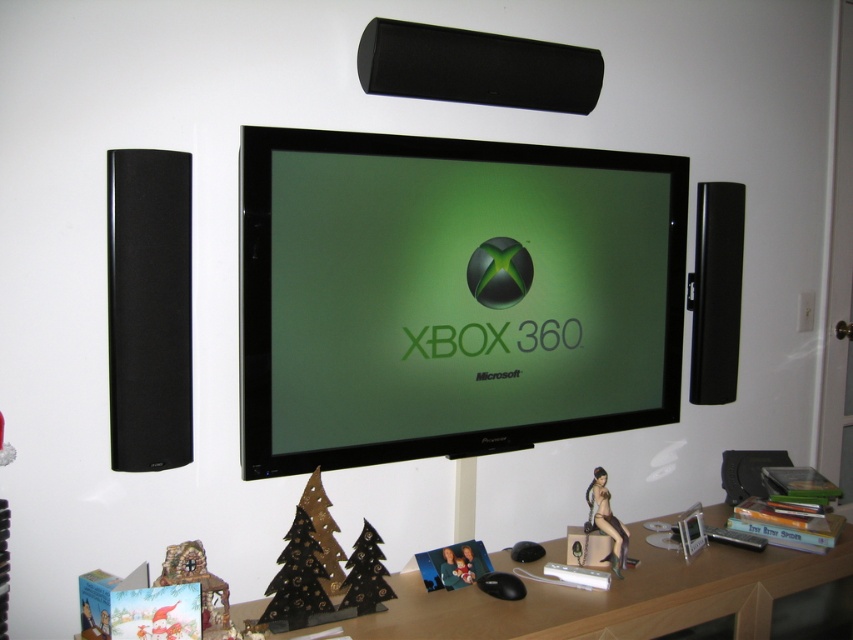
Question: Observing the image, what is the correct spatial positioning of matte black monitor at center in reference to satin nude figurine at lower right?

Choices:
 (A) above
 (B) below

Answer: (A)

Question: Which point appears closest to the camera in this image?

Choices:
 (A) (527, 356)
 (B) (593, 483)

Answer: (B)

Question: Does matte black monitor at center appear on the left side of satin nude figurine at lower right?

Choices:
 (A) no
 (B) yes

Answer: (B)

Question: Which point is closer to the camera taking this photo?

Choices:
 (A) (399, 621)
 (B) (444, 451)
 (C) (592, 480)

Answer: (A)

Question: Which object is farther from the camera taking this photo?

Choices:
 (A) satin nude figurine at lower right
 (B) wooden at lower center

Answer: (A)

Question: Is matte black monitor at center to the left of wooden at lower center from the viewer's perspective?

Choices:
 (A) yes
 (B) no

Answer: (A)